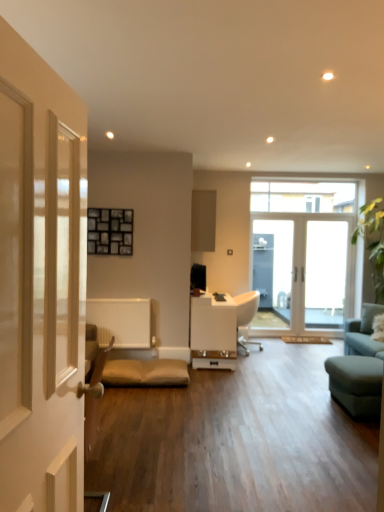
Question: Can you confirm if transparent glass door at center is positioned to the right of white glossy table at center?

Choices:
 (A) yes
 (B) no

Answer: (A)

Question: From a real-world perspective, is transparent glass door at center under white glossy table at center?

Choices:
 (A) yes
 (B) no

Answer: (B)

Question: From a real-world perspective, is transparent glass door at center positioned over white glossy table at center based on gravity?

Choices:
 (A) yes
 (B) no

Answer: (A)

Question: From the image's perspective, would you say transparent glass door at center is shown under white glossy table at center?

Choices:
 (A) yes
 (B) no

Answer: (B)

Question: Could you tell me if transparent glass door at center is turned towards white glossy table at center?

Choices:
 (A) no
 (B) yes

Answer: (A)

Question: Considering their positions, is white plastic chair at center located in front of or behind clear glass window at upper center, which is the 1th window from top to bottom?

Choices:
 (A) front
 (B) behind

Answer: (A)

Question: Visually, is white plastic chair at center positioned to the left or to the right of clear glass window at upper center, which is the second window in bottom-to-top order?

Choices:
 (A) right
 (B) left

Answer: (B)

Question: Based on their sizes in the image, would you say white plastic chair at center is bigger or smaller than clear glass window at upper center, which is the 1th window from top to bottom?

Choices:
 (A) small
 (B) big

Answer: (B)

Question: From a real-world perspective, relative to clear glass window at upper center, which is the 1th window from top to bottom, is white plastic chair at center vertically above or below?

Choices:
 (A) below
 (B) above

Answer: (A)

Question: Considering the positions of matte wood cabinet at center and white glass door at center, which appears as the first window when ordered from the bottom, in the image, is matte wood cabinet at center taller or shorter than white glass door at center, which appears as the first window when ordered from the bottom,?

Choices:
 (A) short
 (B) tall

Answer: (A)

Question: From the image's perspective, is matte wood cabinet at center above or below white glass door at center, the 2th window when ordered from top to bottom?

Choices:
 (A) above
 (B) below

Answer: (A)

Question: From a real-world perspective, is matte wood cabinet at center physically located above or below white glass door at center, the 2th window when ordered from top to bottom?

Choices:
 (A) above
 (B) below

Answer: (A)

Question: Relative to white glass door at center, the 2th window when ordered from top to bottom, is matte wood cabinet at center in front or behind?

Choices:
 (A) front
 (B) behind

Answer: (A)

Question: From the image's perspective, is white plastic chair at center located above or below transparent glass door at center?

Choices:
 (A) below
 (B) above

Answer: (A)

Question: Relative to transparent glass door at center, is white plastic chair at center in front or behind?

Choices:
 (A) front
 (B) behind

Answer: (A)